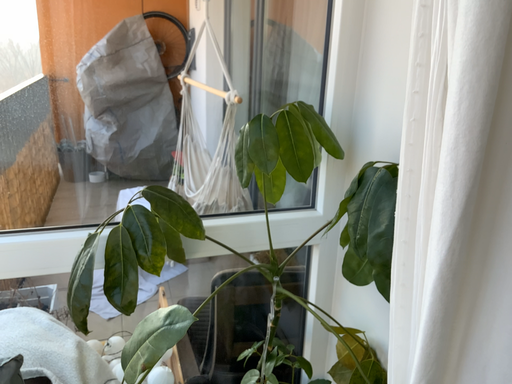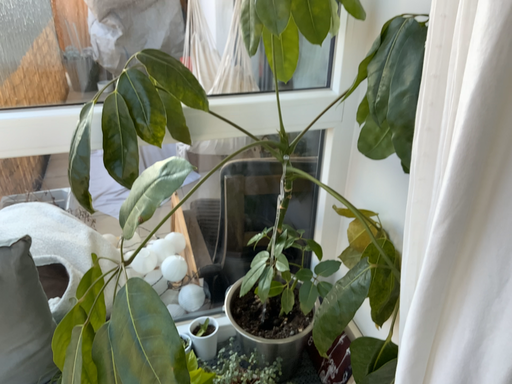
Question: Which way did the camera rotate in the video?

Choices:
 (A) rotated downward
 (B) rotated upward

Answer: (A)